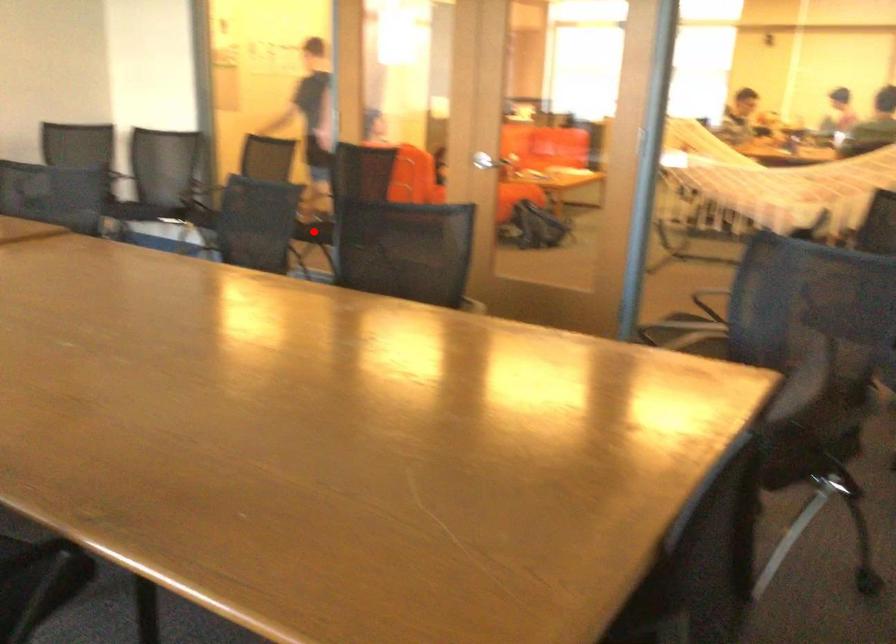
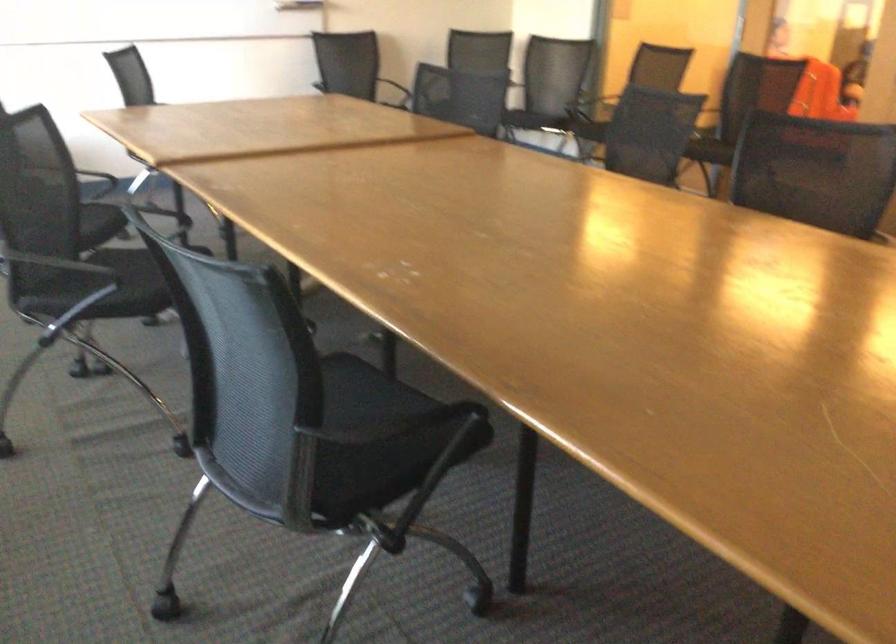
Question: I am providing you with two images of the same scene from different viewpoints. A red point is marked on the first image. Is the red point's position out of view in image 2?

Choices:
 (A) Yes
 (B) No

Answer: (A)